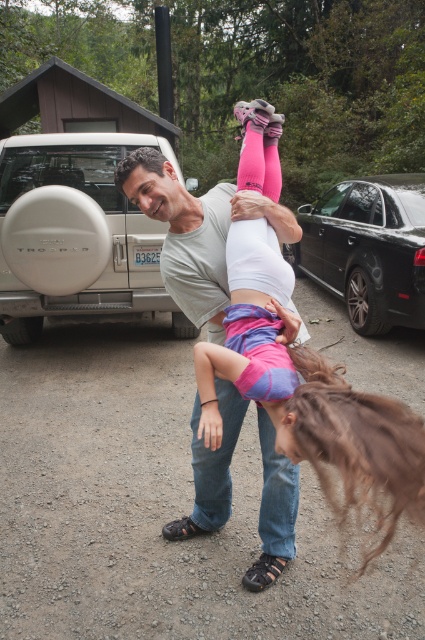
You are a delivery person trying to park your van between the white matte spare tire at left and the black metallic car at right. Can you fit your van there if it requires 2 meters of space?

The white matte spare tire at left is to the left of the black metallic car at right, but the distance between them is not provided. Without knowing the exact spacing, it is impossible to determine if the van can fit.

You are a photographer trying to capture a candid shot of the pink fabric pants at center and the white matte spare tire at left. Given their sizes, which object should you zoom in on to ensure both fit in the frame without cropping?

Since the pink fabric pants at center occupies less space than the white matte spare tire at left, you should zoom in on the white matte spare tire at left to ensure both fit in the frame without cropping.

You are standing at the origin point in the image and want to walk towards the point labeled as point [88,189]. Which direction should you go relative to the point labeled as point [350,195]?

You should walk towards the point labeled as point [88,189], which is in front of the point labeled as point [350,195].